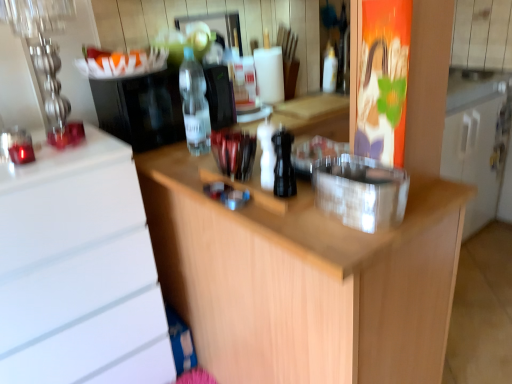
Find the location of `free space in front of black matte pepper grinder at center, which ranks as the 2th bottle in left-to-right order`. free space in front of black matte pepper grinder at center, which ranks as the 2th bottle in left-to-right order is located at coordinates (300, 210).